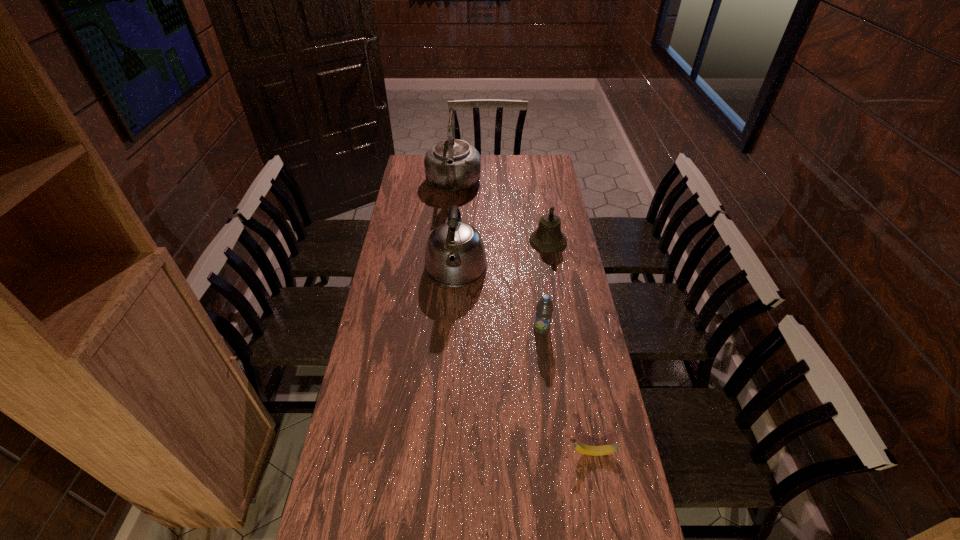
Find the location of `free location located on the left of the bell`. free location located on the left of the bell is located at coordinates (470, 241).

The width and height of the screenshot is (960, 540). Identify the location of vacant region located on the right of the fourth farthest object. (573, 329).

The image size is (960, 540). I want to click on free point located 0.080m at the stem of the banana, so pos(537,453).

At what (x,y) coordinates should I click in order to perform the action: click on free space located at the stem of the banana. Please return your answer as a coordinate pair (x, y). This screenshot has height=540, width=960. Looking at the image, I should click on (483, 453).

The height and width of the screenshot is (540, 960). What are the coordinates of `free space located 0.340m at the stem of the banana` in the screenshot? It's located at (444, 453).

Where is `object that is at the far edge`? The image size is (960, 540). object that is at the far edge is located at coordinates (451, 165).

Identify the location of object that is at the left edge. The height and width of the screenshot is (540, 960). (451, 165).

In order to click on bell that is at the right edge in this screenshot , I will do `click(548, 238)`.

Locate an element on the screen. water bottle positioned at the right edge is located at coordinates (544, 308).

Locate an element on the screen. The image size is (960, 540). banana at the right edge is located at coordinates pos(579,447).